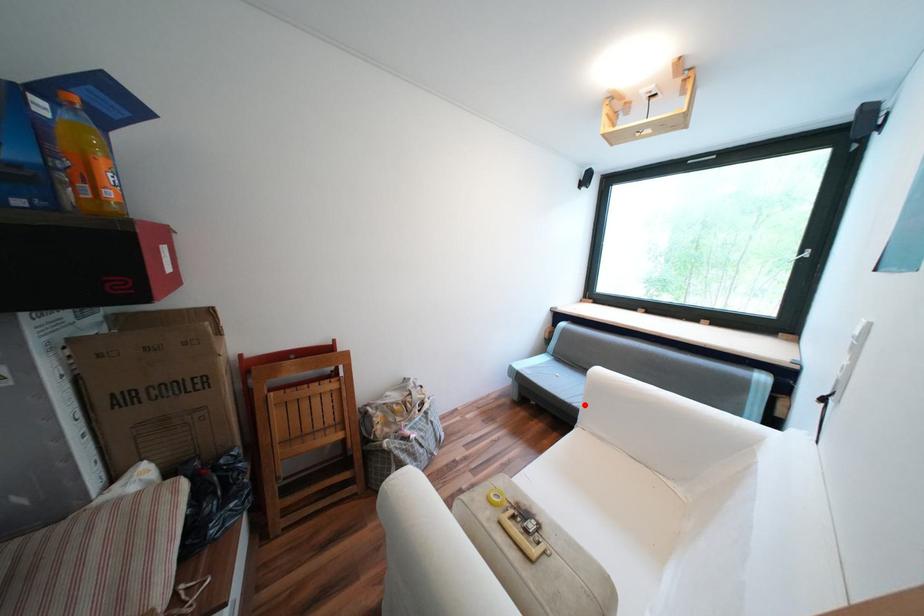
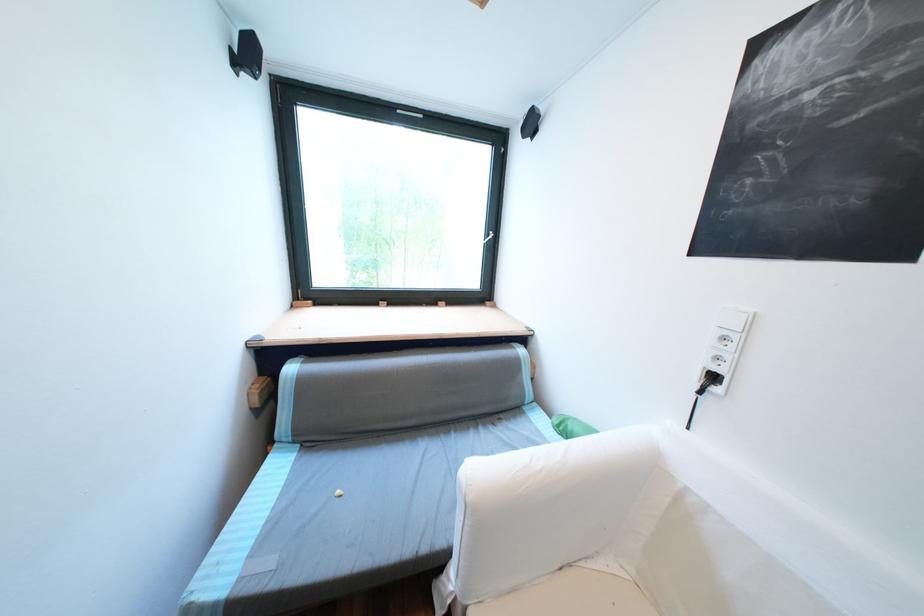
In the second image, find the point that corresponds to the highlighted location in the first image.

(433, 549)